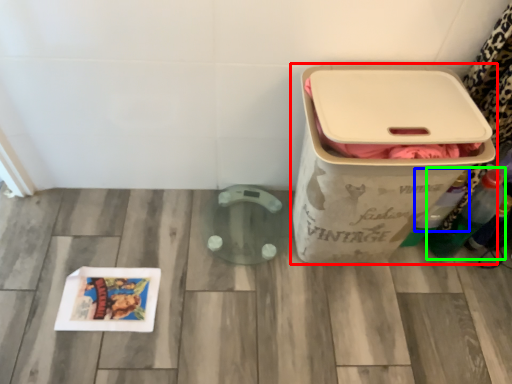
Question: Which object is the farthest from waste container (highlighted by a red box)? Choose among these: bottle (highlighted by a blue box) or bottle (highlighted by a green box).

Choices:
 (A) bottle
 (B) bottle

Answer: (B)